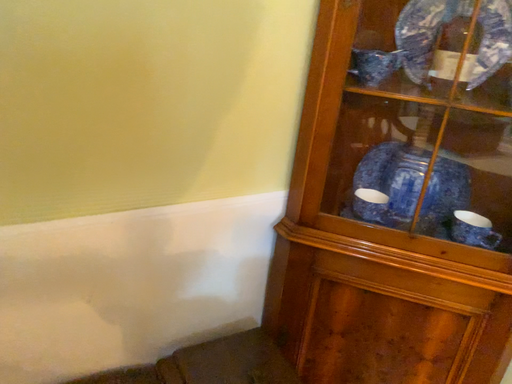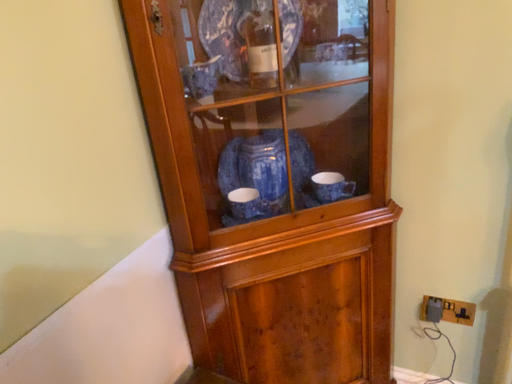
Question: How did the camera likely rotate when shooting the video?

Choices:
 (A) rotated right
 (B) rotated left

Answer: (A)